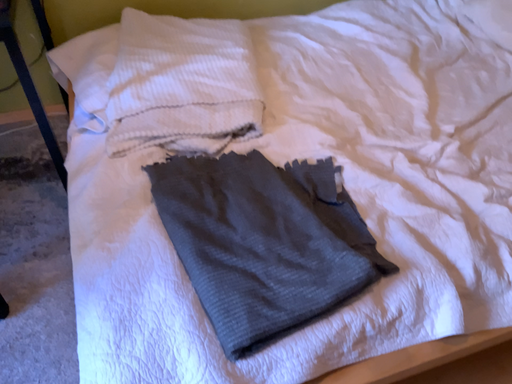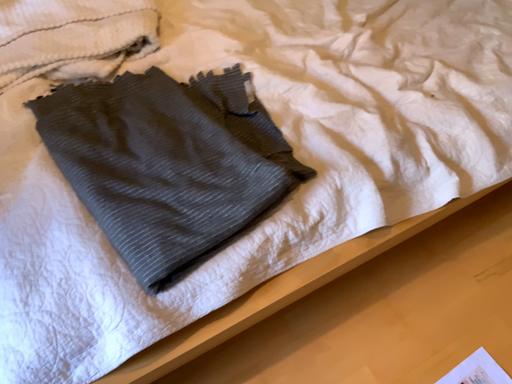
Question: Which way did the camera rotate in the video?

Choices:
 (A) rotated downward
 (B) rotated upward

Answer: (A)